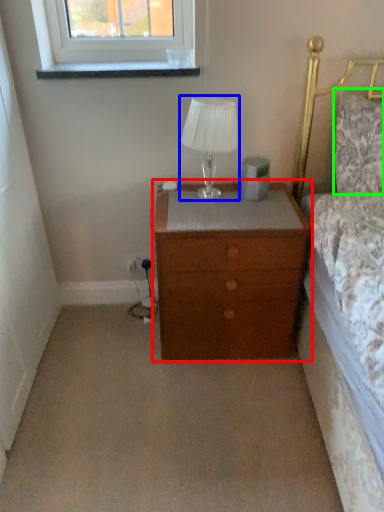
Question: Estimate the real-world distances between objects in this image. Which object is closer to nightstand (highlighted by a red box), table lamp (highlighted by a blue box) or pillow (highlighted by a green box)?

Choices:
 (A) table lamp
 (B) pillow

Answer: (A)